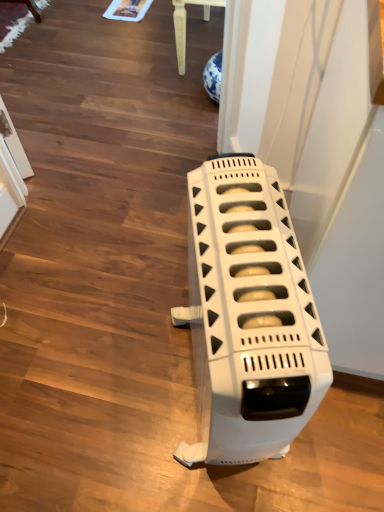
The image size is (384, 512). What are the coordinates of `vacant space to the left of white glossy radiator at center` in the screenshot? It's located at (109, 389).